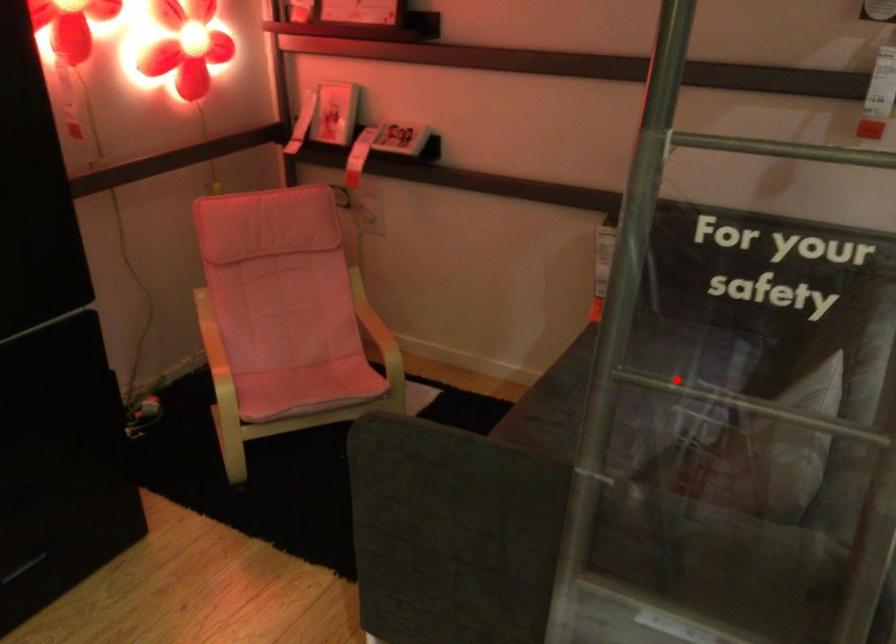
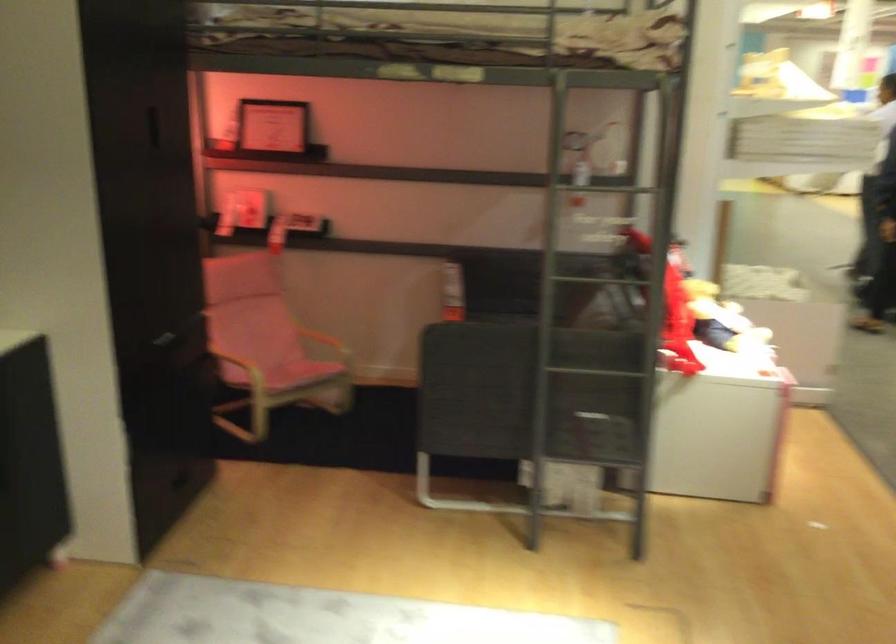
Question: I am providing you with two images of the same scene from different viewpoints. In image1, a red point is highlighted. Considering the same 3D point in image2, which of the following is correct?

Choices:
 (A) It is closer
 (B) It is farther

Answer: (B)